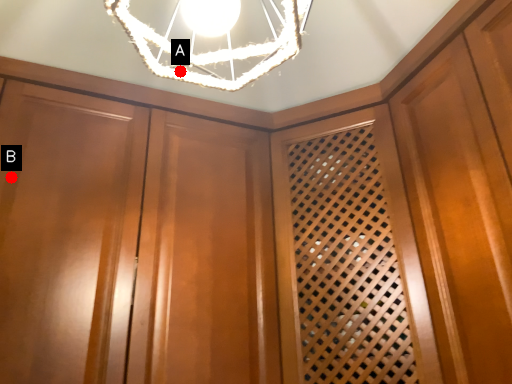
Question: Two points are circled on the image, labeled by A and B beside each circle. Which of the following is the closest to the observer?

Choices:
 (A) A is closer
 (B) B is closer

Answer: (A)